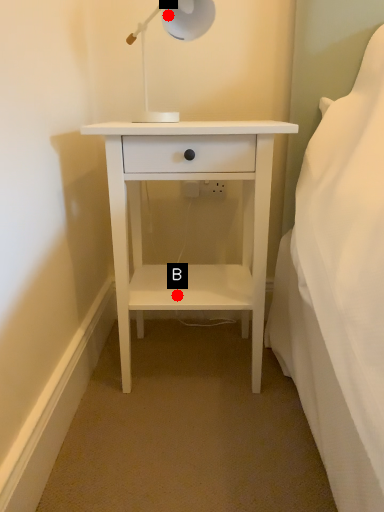
Question: Two points are circled on the image, labeled by A and B beside each circle. Which of the following is the farthest from the observer?

Choices:
 (A) A is further
 (B) B is further

Answer: (B)